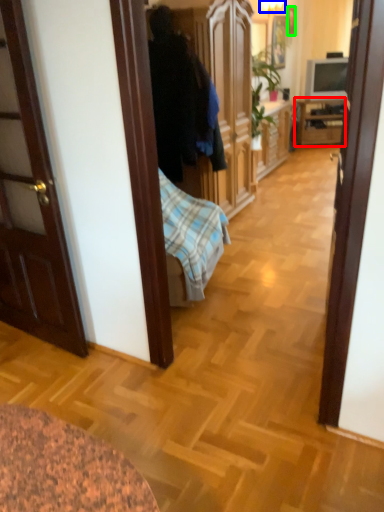
Question: Which object is the closest to the cabinetry (highlighted by a red box)? Choose among these: lamp (highlighted by a blue box) or picture frame (highlighted by a green box).

Choices:
 (A) lamp
 (B) picture frame

Answer: (B)